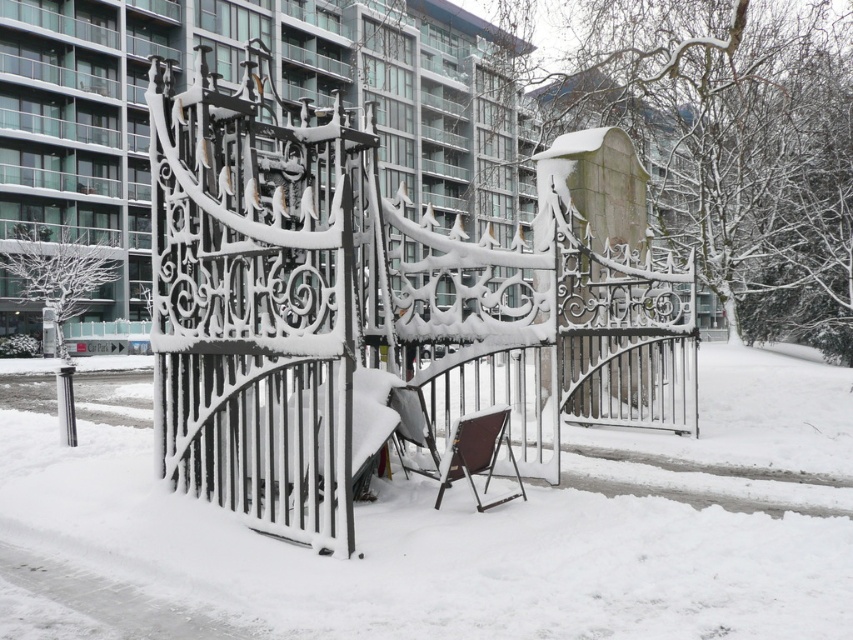
Question: Which of the following is the closest to the observer?

Choices:
 (A) snow-covered wrought iron gate at center
 (B) white matte snow at center

Answer: (B)

Question: Where is snow-covered wrought iron gate at center located in relation to white matte snow at center in the image?

Choices:
 (A) right
 (B) left

Answer: (B)

Question: Which object appears closest to the camera in this image?

Choices:
 (A) snow-covered wrought iron gate at center
 (B) white matte snow at center

Answer: (B)

Question: Which is nearer to the white matte snow at center?

Choices:
 (A) snow-covered wrought iron gate at center
 (B) brown fabric chair at center

Answer: (B)

Question: Is snow-covered wrought iron gate at center to the left of white matte snow at center from the viewer's perspective?

Choices:
 (A) yes
 (B) no

Answer: (A)

Question: Does snow-covered wrought iron gate at center appear on the right side of white matte snow at center?

Choices:
 (A) no
 (B) yes

Answer: (A)